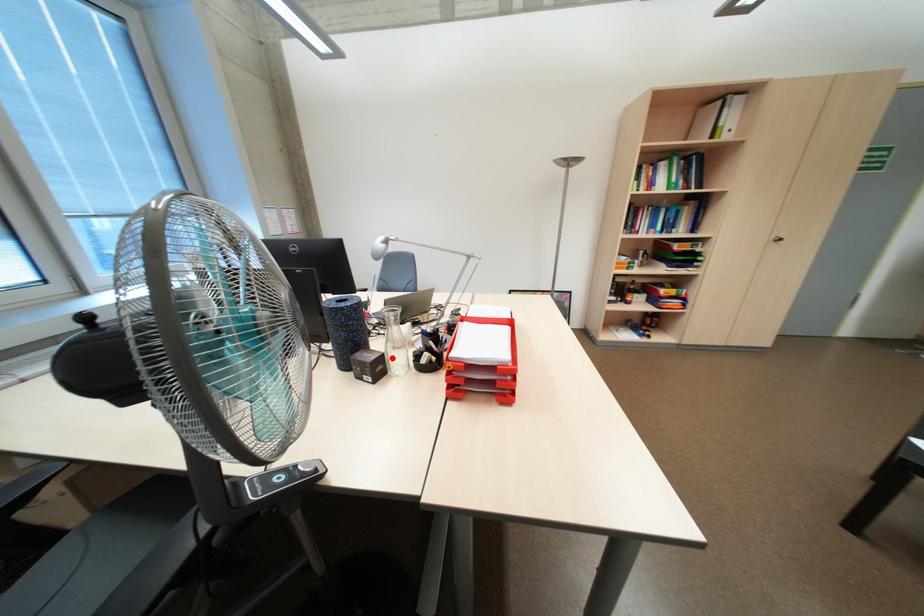
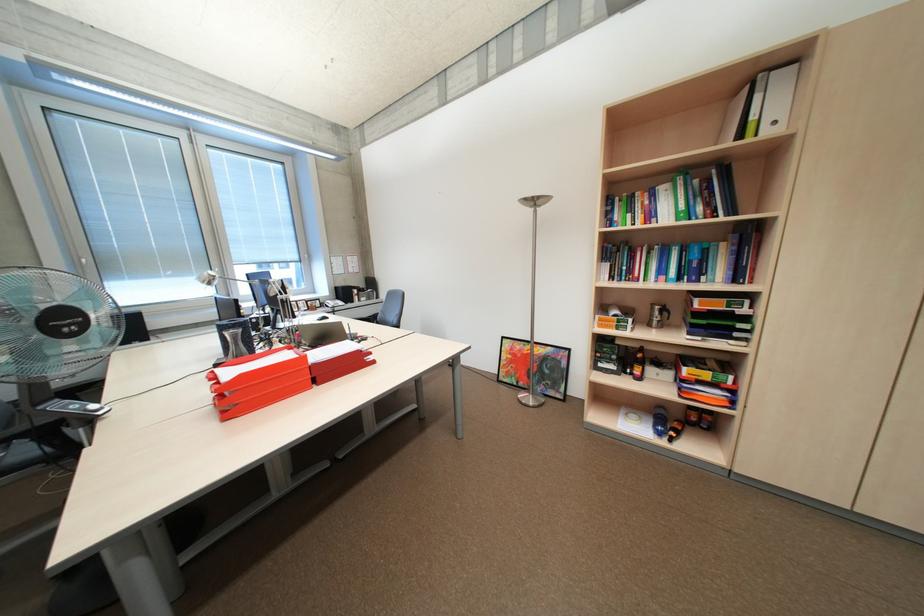
Question: I am providing you with two images of the same scene from different viewpoints. A red point is marked on the first image. At the location where the point appears in image 1, is it still visible in image 2?

Choices:
 (A) Yes
 (B) No

Answer: (B)